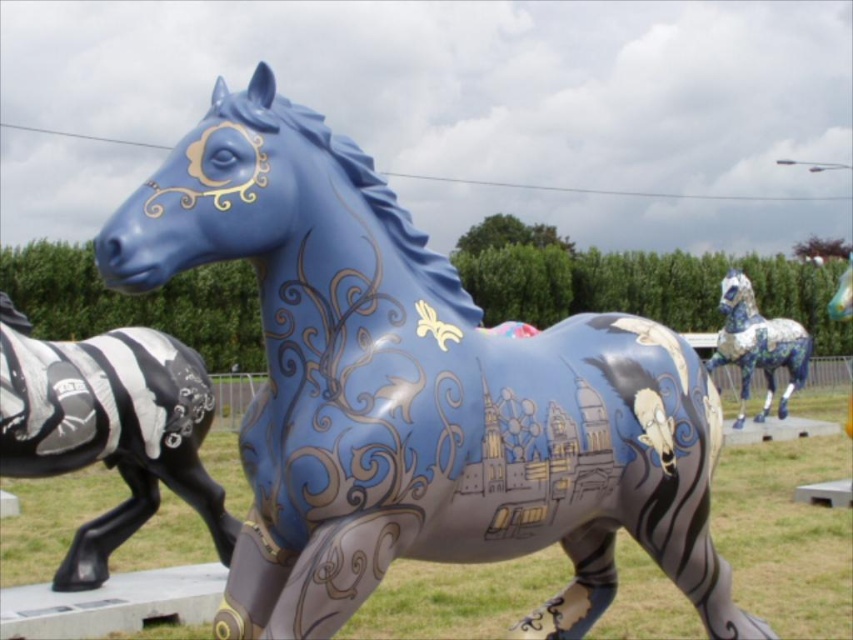
Question: Is metallic silver zebra at left thinner than porcelain mosaic horse at right?

Choices:
 (A) yes
 (B) no

Answer: (A)

Question: Can you confirm if glossy blue horse at center is positioned below metallic silver zebra at left?

Choices:
 (A) yes
 (B) no

Answer: (B)

Question: Based on their relative distances, which object is farther from the porcelain mosaic horse at right?

Choices:
 (A) metallic silver zebra at left
 (B) glossy blue horse at center

Answer: (B)

Question: Which of these objects is positioned closest to the glossy blue horse at center?

Choices:
 (A) metallic silver zebra at left
 (B) porcelain mosaic horse at right

Answer: (A)

Question: Estimate the real-world distances between objects in this image. Which object is farther from the glossy blue horse at center?

Choices:
 (A) porcelain mosaic horse at right
 (B) metallic silver zebra at left

Answer: (A)

Question: Is glossy blue horse at center to the left of metallic silver zebra at left from the viewer's perspective?

Choices:
 (A) yes
 (B) no

Answer: (B)